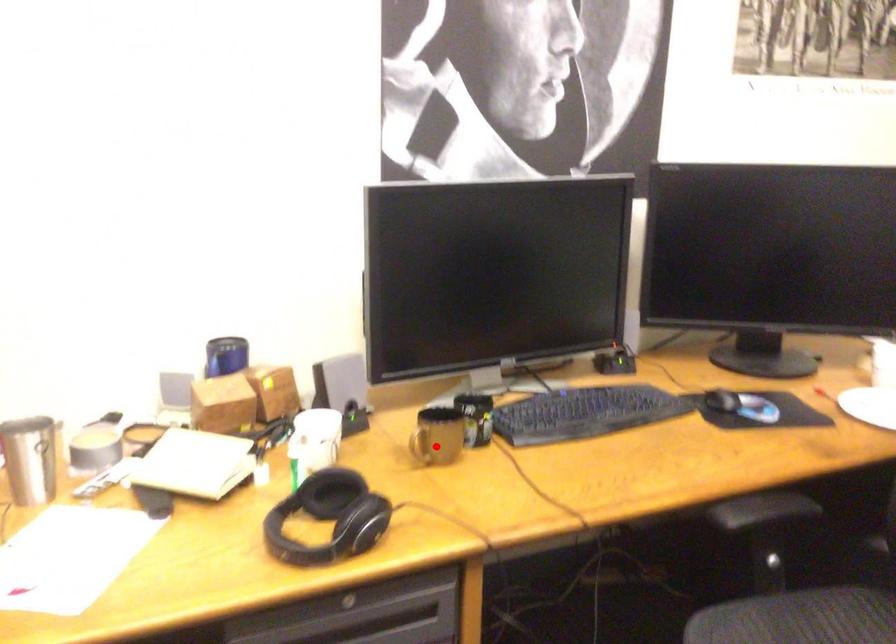
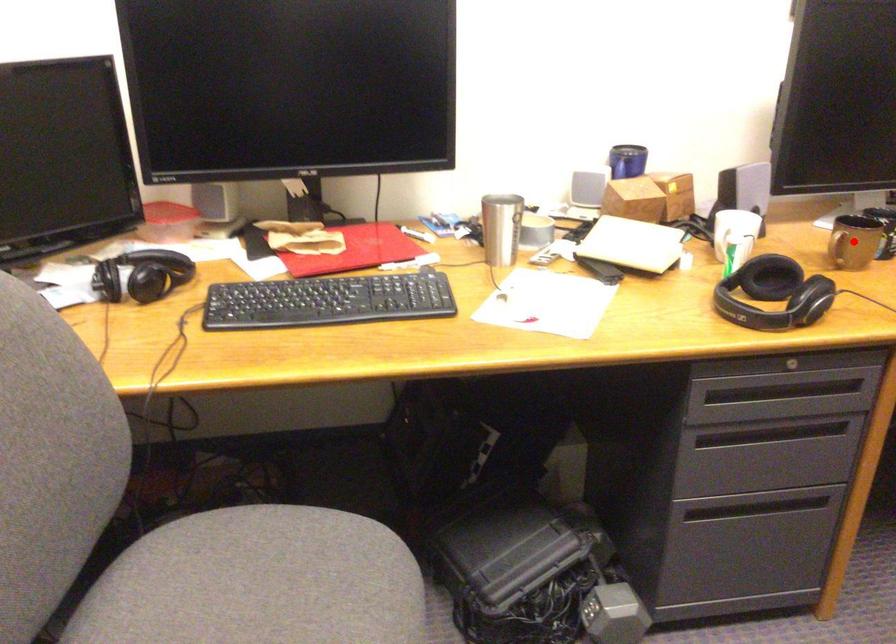
I am providing you with two images of the same scene from different viewpoints. A red point is marked on the first image and another point is marked on the second image. Do the highlighted points in image1 and image2 indicate the same real-world spot?

Yes